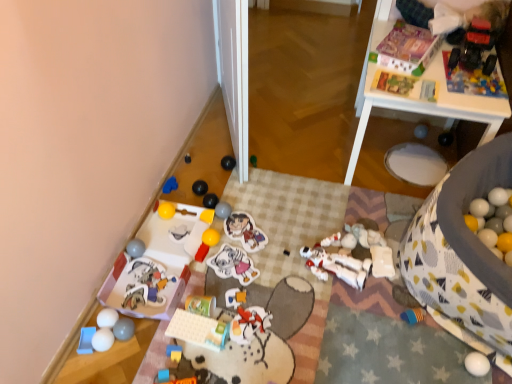
Locate an element on the screen. The image size is (512, 384). vacant space behind yellow rubber ball at center, the 16th toy positioned from the left is located at coordinates (225, 217).